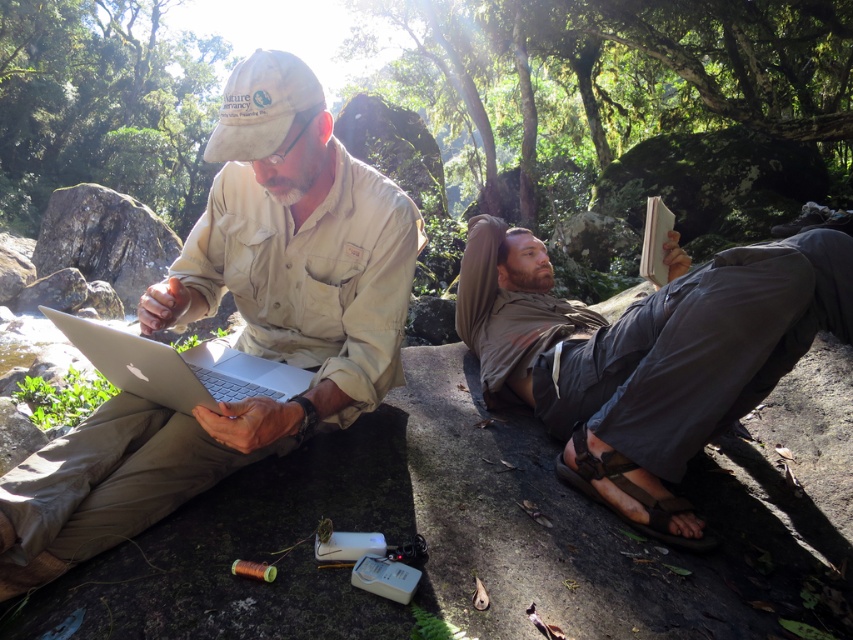
Is khaki cotton pants at center above silver metallic laptop at center?

Correct, khaki cotton pants at center is located above silver metallic laptop at center.

Consider the image. Between khaki cotton pants at center and silver metallic laptop at center, which one is positioned lower?

silver metallic laptop at center is below.

Who is more distant from viewer, (x=740, y=353) or (x=241, y=365)?

The point (x=241, y=365) is more distant.

Locate an element on the screen. The height and width of the screenshot is (640, 853). khaki cotton pants at center is located at coordinates (656, 346).

Does matte khaki shirt at center have a greater width compared to silver metallic laptop at center?

Indeed, matte khaki shirt at center has a greater width compared to silver metallic laptop at center.

Measure the distance between point (339, 312) and camera.

They are 1.45 meters apart.

Locate an element on the screen. matte khaki shirt at center is located at coordinates (241, 330).

Can you confirm if silver metallic laptop at center is wider than brown leather sandal at lower center?

Yes, silver metallic laptop at center is wider than brown leather sandal at lower center.

The height and width of the screenshot is (640, 853). What do you see at coordinates (178, 368) in the screenshot?
I see `silver metallic laptop at center` at bounding box center [178, 368].

What do you see at coordinates (178, 368) in the screenshot? The height and width of the screenshot is (640, 853). I see `silver metallic laptop at center` at bounding box center [178, 368].

At what (x,y) coordinates should I click in order to perform the action: click on silver metallic laptop at center. Please return your answer as a coordinate pair (x, y). Looking at the image, I should click on (178, 368).